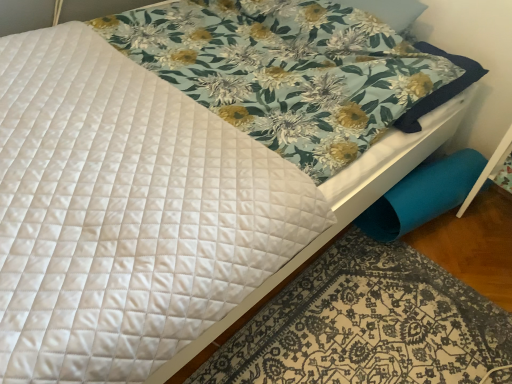
Question: Does blue fabric swivel chair at lower right have a greater width compared to blue fabric at lower right?

Choices:
 (A) yes
 (B) no

Answer: (B)

Question: Is blue fabric swivel chair at lower right with blue fabric at lower right?

Choices:
 (A) yes
 (B) no

Answer: (B)

Question: Does blue fabric swivel chair at lower right come behind blue fabric at lower right?

Choices:
 (A) yes
 (B) no

Answer: (A)

Question: From the image's perspective, does blue fabric swivel chair at lower right appear lower than blue fabric at lower right?

Choices:
 (A) no
 (B) yes

Answer: (A)

Question: Is blue fabric at lower right at the back of blue fabric swivel chair at lower right?

Choices:
 (A) yes
 (B) no

Answer: (B)

Question: From the image's perspective, does blue fabric swivel chair at lower right appear higher than blue fabric at lower right?

Choices:
 (A) no
 (B) yes

Answer: (B)

Question: Is blue fabric at lower right oriented away from blue fabric swivel chair at lower right?

Choices:
 (A) yes
 (B) no

Answer: (B)

Question: Is blue fabric at lower right shorter than blue fabric swivel chair at lower right?

Choices:
 (A) no
 (B) yes

Answer: (B)

Question: Is blue fabric at lower right bigger than blue fabric swivel chair at lower right?

Choices:
 (A) yes
 (B) no

Answer: (A)

Question: From a real-world perspective, is blue fabric at lower right positioned under blue fabric swivel chair at lower right based on gravity?

Choices:
 (A) no
 (B) yes

Answer: (B)

Question: Is blue fabric at lower right behind blue fabric swivel chair at lower right?

Choices:
 (A) no
 (B) yes

Answer: (A)

Question: From a real-world perspective, does blue fabric at lower right stand above blue fabric swivel chair at lower right?

Choices:
 (A) yes
 (B) no

Answer: (B)

Question: Is blue fabric swivel chair at lower right inside the boundaries of blue fabric at lower right, or outside?

Choices:
 (A) outside
 (B) inside

Answer: (A)